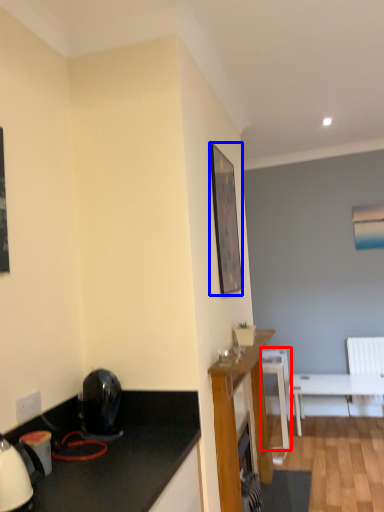
Question: Which object is closer to the camera taking this photo, chair (highlighted by a red box) or picture frame (highlighted by a blue box)?

Choices:
 (A) chair
 (B) picture frame

Answer: (B)